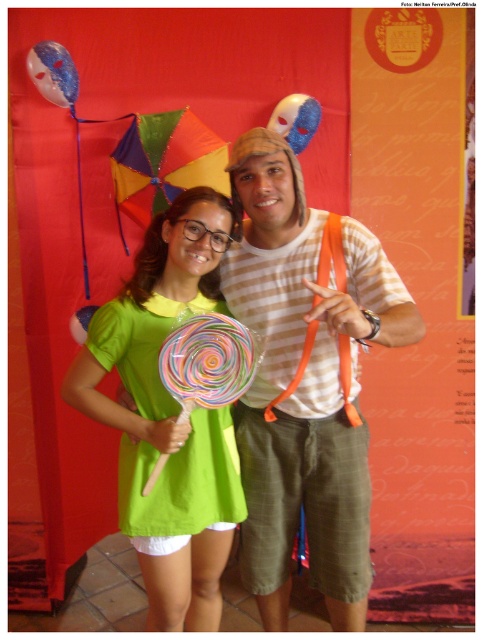
Does striped cotton shirt at center appear on the left side of green matte dress at center?

Incorrect, striped cotton shirt at center is not on the left side of green matte dress at center.

Can you confirm if striped cotton shirt at center is wider than green matte dress at center?

Yes.

This screenshot has width=483, height=640. Find the location of `striped cotton shirt at center`. striped cotton shirt at center is located at coordinates (304, 381).